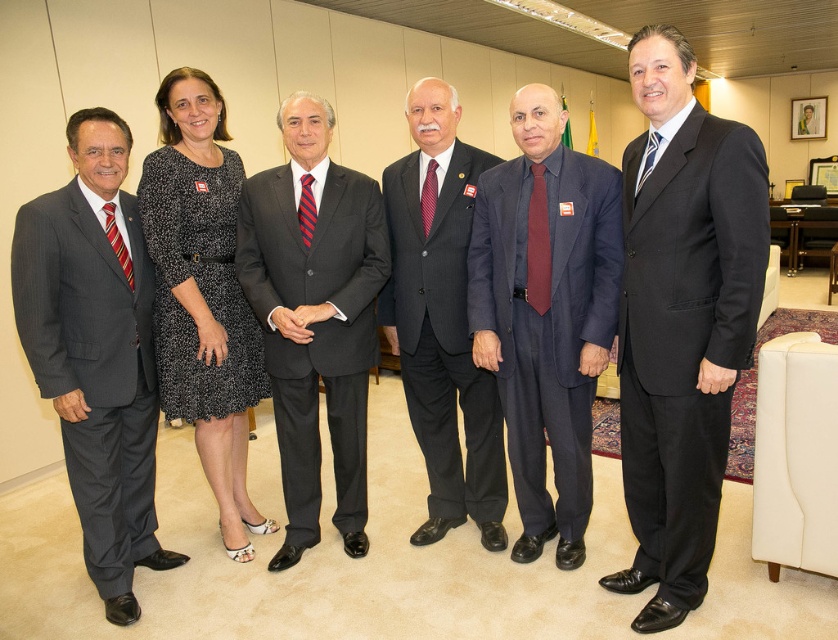
You are a photographer setting up for a group photo. You need to ensure that the person in the dark gray suit at center is positioned to the right of the red silk tie at center. Based on the current arrangement, is this requirement already met?

The dark gray suit at center is currently to the left of the red silk tie at center, so the requirement is not met. The photographer needs to adjust their positions to swap their current left and right arrangement.

In the formal group photo, there are two men wearing a dark gray suit at center and a white striped tie at right. Which one is positioned to the left of the other?

The dark gray suit at center is positioned to the left of the white striped tie at right.

You are standing in the office and see the point at coordinates (x=681, y=321). Which object is this point located on?

The point at coordinates (x=681, y=321) is located on the black suit at right.